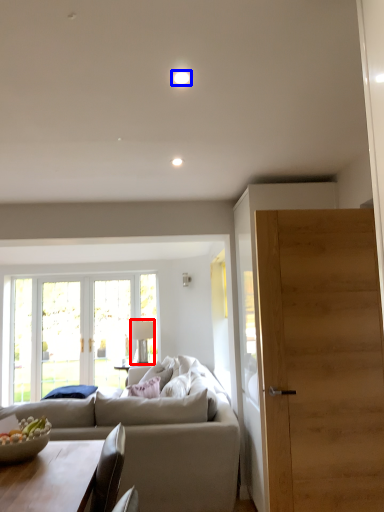
Question: Which point is closer to the camera, lamp (highlighted by a red box) or light (highlighted by a blue box)?

Choices:
 (A) lamp
 (B) light

Answer: (B)